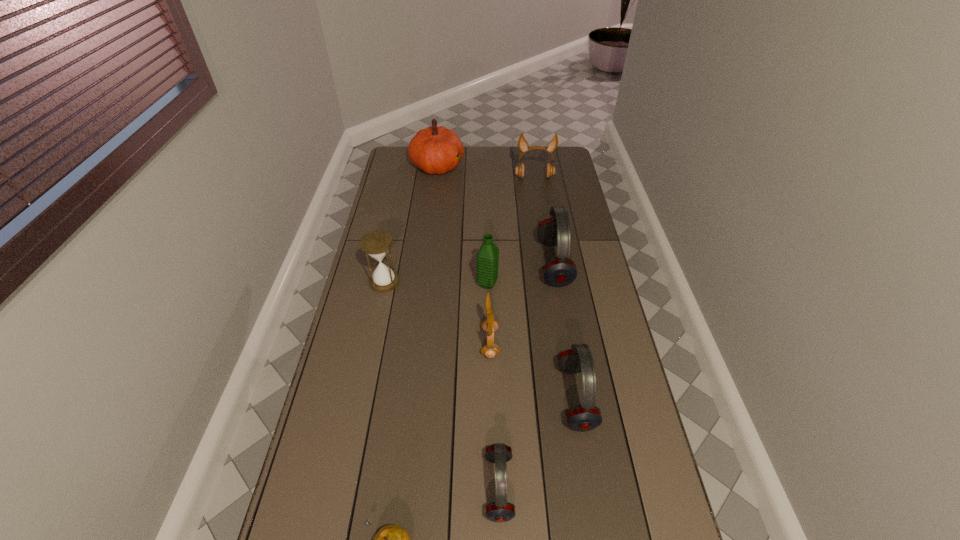
The height and width of the screenshot is (540, 960). In order to click on vacant region between the biggest red earphone and the leftmost red earphone in this screenshot , I will do point(526,375).

Locate an element on the screen. the second closest object relative to the pink pumpkin is located at coordinates (560, 271).

Identify which object is the fifth closest to the shortest object. Please provide its 2D coordinates. Your answer should be formatted as a tuple, i.e. [(x, y)], where the tuple contains the x and y coordinates of a point satisfying the conditions above.

[(488, 255)]

You are a GUI agent. You are given a task and a screenshot of the screen. Output one action in this format:
    pyautogui.click(x=<x>, y=<y>)
    Task: Click on the earphone identified as the fourth closest to the nearer brown earphone
    This screenshot has height=540, width=960.
    Given the screenshot: What is the action you would take?
    pyautogui.click(x=550, y=170)

The image size is (960, 540). In order to click on earphone that stands as the second closest to the second farthest earphone in this screenshot , I will do `click(585, 417)`.

This screenshot has width=960, height=540. Find the location of `red earphone that is the second closest to the fourth nearest earphone`. red earphone that is the second closest to the fourth nearest earphone is located at coordinates (499, 511).

Select which red earphone appears as the third closest to the pear. Please provide its 2D coordinates. Your answer should be formatted as a tuple, i.e. [(x, y)], where the tuple contains the x and y coordinates of a point satisfying the conditions above.

[(560, 271)]